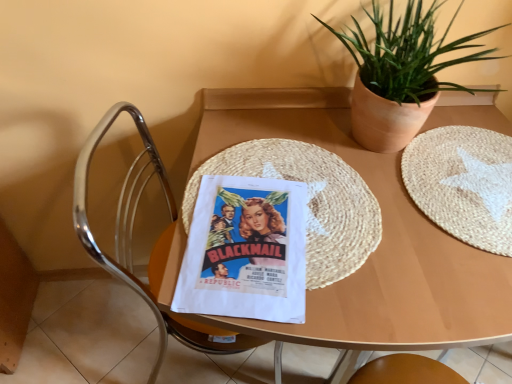
The image size is (512, 384). What do you see at coordinates (377, 248) in the screenshot?
I see `wooden placemat at center` at bounding box center [377, 248].

The width and height of the screenshot is (512, 384). Find the location of `matte paper poster at center`. matte paper poster at center is located at coordinates (245, 251).

What are the coordinates of `white woven placemat at center right` in the screenshot? It's located at (463, 183).

What is the approximate height of polished chrome chair at left?

It is 33.20 inches.

Find the location of a particular element. polished chrome chair at left is located at coordinates (154, 246).

Find the location of a particular element. wooden placemat at center is located at coordinates (377, 248).

Considering the positions of point (496, 127) and point (270, 194), is point (496, 127) closer or farther from the camera than point (270, 194)?

Point (496, 127) is positioned farther from the camera compared to point (270, 194).

Are wooden placemat at center and matte paper poster at center making contact?

wooden placemat at center and matte paper poster at center are clearly separated.

Is wooden placemat at center oriented away from matte paper poster at center?

No, wooden placemat at center's orientation is not away from matte paper poster at center.

What's the angular difference between wooden placemat at center and matte paper poster at center's facing directions?

They differ by 10.3 degrees in their facing directions.

Does wooden placemat at center turn towards white woven placemat at center right?

No, wooden placemat at center does not turn towards white woven placemat at center right.

Which object is positioned more to the left, wooden placemat at center or white woven placemat at center right?

wooden placemat at center.

From the image's perspective, which is above, wooden placemat at center or white woven placemat at center right?

white woven placemat at center right.

Is point (368, 288) farther from camera compared to point (469, 200)?

No.

Considering the relative sizes of woven straw mat at center and polished chrome chair at left in the image provided, is woven straw mat at center thinner than polished chrome chair at left?

Incorrect, the width of woven straw mat at center is not less than that of polished chrome chair at left.

Which object is positioned more to the right, woven straw mat at center or polished chrome chair at left?

Positioned to the right is woven straw mat at center.

Can you tell me how much woven straw mat at center and polished chrome chair at left differ in facing direction?

There is a 88.7-degree angle between the facing directions of woven straw mat at center and polished chrome chair at left.

Is woven straw mat at center closer to the viewer compared to polished chrome chair at left?

No, woven straw mat at center is behind polished chrome chair at left.

Would you consider matte paper poster at center to be distant from woven straw mat at center?

No, there isn't a large distance between matte paper poster at center and woven straw mat at center.

Can you tell me how much matte paper poster at center and woven straw mat at center differ in facing direction?

7.66 degrees.

Could you tell me if matte paper poster at center is turned towards woven straw mat at center?

Yes, matte paper poster at center is aimed at woven straw mat at center.

Considering the relative sizes of matte paper poster at center and woven straw mat at center in the image provided, is matte paper poster at center taller than woven straw mat at center?

Yes.

This screenshot has width=512, height=384. Find the location of `table located in front of the green leafy plant in clay pot at upper right`. table located in front of the green leafy plant in clay pot at upper right is located at coordinates (377, 248).

Does green leafy plant in clay pot at upper right contain wooden placemat at center?

No, wooden placemat at center is located outside of green leafy plant in clay pot at upper right.

From the image's perspective, is green leafy plant in clay pot at upper right above wooden placemat at center?

Yes.

Does green leafy plant in clay pot at upper right have a smaller size compared to wooden placemat at center?

Yes.

Which is behind, green leafy plant in clay pot at upper right or woven straw mat at center?

woven straw mat at center is more distant.

From the picture: Which point is more distant from viewer, (475, 54) or (357, 258)?

The point (475, 54) is farther.

Considering the sizes of green leafy plant in clay pot at upper right and woven straw mat at center in the image, is green leafy plant in clay pot at upper right taller or shorter than woven straw mat at center?

Clearly, green leafy plant in clay pot at upper right is taller compared to woven straw mat at center.

In terms of size, does green leafy plant in clay pot at upper right appear bigger or smaller than matte paper poster at center?

In the image, green leafy plant in clay pot at upper right appears to be larger than matte paper poster at center.

Which of these two, green leafy plant in clay pot at upper right or matte paper poster at center, stands taller?

green leafy plant in clay pot at upper right is taller.

Would you say green leafy plant in clay pot at upper right is a long distance from matte paper poster at center?

No, green leafy plant in clay pot at upper right is not far from matte paper poster at center.

From a real-world perspective, is green leafy plant in clay pot at upper right positioned above or below matte paper poster at center?

green leafy plant in clay pot at upper right is above matte paper poster at center.

Find the location of a particular element. The image size is (512, 384). comic book behind the wooden placemat at center is located at coordinates (245, 251).

This screenshot has height=384, width=512. Find the location of `paper plate above the wooden placemat at center (from the image's perspective)`. paper plate above the wooden placemat at center (from the image's perspective) is located at coordinates (463, 183).

Based on their spatial positions, is wooden placemat at center or matte paper poster at center closer to green leafy plant in clay pot at upper right?

Among the two, wooden placemat at center is located nearer to green leafy plant in clay pot at upper right.

When comparing their distances from wooden placemat at center, does matte paper poster at center or polished chrome chair at left seem further?

polished chrome chair at left is further to wooden placemat at center.

Looking at the image, which one is located closer to matte paper poster at center, green leafy plant in clay pot at upper right or white woven placemat at center right?

white woven placemat at center right lies closer to matte paper poster at center than the other object.

Considering their positions, is green leafy plant in clay pot at upper right positioned further to white woven placemat at center right than polished chrome chair at left?

The object further to white woven placemat at center right is polished chrome chair at left.

Looking at this image, from the image, which object appears to be farther from matte paper poster at center, white woven placemat at center right or wooden placemat at center?

white woven placemat at center right is further to matte paper poster at center.

Looking at the image, which one is located further to polished chrome chair at left, white woven placemat at center right or woven straw mat at center?

white woven placemat at center right.

Looking at the image, which one is located further to green leafy plant in clay pot at upper right, woven straw mat at center or matte paper poster at center?

matte paper poster at center is further to green leafy plant in clay pot at upper right.

Looking at the image, which one is located closer to wooden placemat at center, green leafy plant in clay pot at upper right or white woven placemat at center right?

white woven placemat at center right is positioned closer to the anchor wooden placemat at center.

What are the coordinates of `mat between green leafy plant in clay pot at upper right and matte paper poster at center in the up-down direction` in the screenshot? It's located at click(x=307, y=201).

Image resolution: width=512 pixels, height=384 pixels. I want to click on mat between matte paper poster at center and white woven placemat at center right from left to right, so click(x=307, y=201).

At what (x,y) coordinates should I click in order to perform the action: click on mat located between matte paper poster at center and wooden placemat at center in the left-right direction. Please return your answer as a coordinate pair (x, y). Looking at the image, I should click on (307, 201).

At what (x,y) coordinates should I click in order to perform the action: click on mat between polished chrome chair at left and white woven placemat at center right from left to right. Please return your answer as a coordinate pair (x, y). The width and height of the screenshot is (512, 384). Looking at the image, I should click on (307, 201).